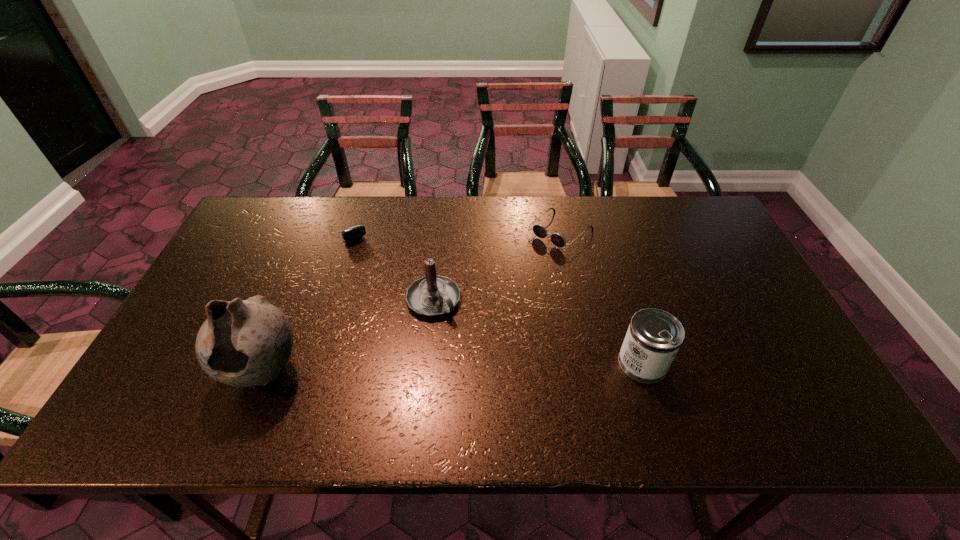
You are a GUI agent. You are given a task and a screenshot of the screen. Output one action in this format:
    pyautogui.click(x=<x>, y=<y>)
    Task: Click on the tallest object
    Image resolution: width=960 pixels, height=540 pixels.
    Given the screenshot: What is the action you would take?
    pyautogui.click(x=243, y=343)

You are a GUI agent. You are given a task and a screenshot of the screen. Output one action in this format:
    pyautogui.click(x=<x>, y=<y>)
    Task: Click on the can
    The height and width of the screenshot is (540, 960).
    Given the screenshot: What is the action you would take?
    pyautogui.click(x=654, y=336)

This screenshot has width=960, height=540. Identify the location of sunglasses. (540, 231).

Image resolution: width=960 pixels, height=540 pixels. Identify the location of webcam. (353, 233).

Where is `the third object from left to right`? the third object from left to right is located at coordinates (432, 295).

The width and height of the screenshot is (960, 540). I want to click on candle, so click(432, 295).

Where is `free spot located 0.210m on the left of the can`? This screenshot has width=960, height=540. free spot located 0.210m on the left of the can is located at coordinates (532, 363).

Identify the location of vacant space located 0.340m on the front-facing side of the sunglasses. This screenshot has width=960, height=540. (469, 311).

Find the location of `free space located 0.080m on the front-facing side of the sunglasses`. free space located 0.080m on the front-facing side of the sunglasses is located at coordinates (527, 261).

The image size is (960, 540). I want to click on free space located 0.380m on the front-facing side of the sunglasses, so click(460, 320).